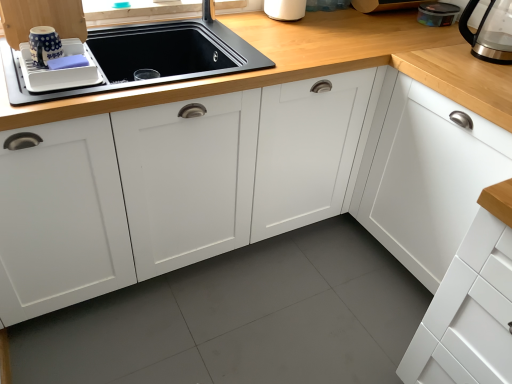
Question: Does point (10, 24) appear closer or farther from the camera than point (435, 11)?

Choices:
 (A) closer
 (B) farther

Answer: (A)

Question: Relative to transparent plastic container at upper right, which is the third appliance from front to back, is white glossy tray at upper left, the first cabinetry when ordered from left to right, in front or behind?

Choices:
 (A) front
 (B) behind

Answer: (A)

Question: Estimate the real-world distances between objects in this image. Which object is farther from the wooden cutting board at upper right, marked as the 4th appliance in a front-to-back arrangement?

Choices:
 (A) white plastic dish drainer at upper left, the 4th appliance from the back
 (B) blue dotted cup at upper left, which is the 2th appliance from front to back
 (C) white matte cabinet at center-right, the first cabinetry when ordered from right to left
 (D) white glossy tray at upper left, the first cabinetry when ordered from left to right
 (E) white glossy cabinet at center, which is the second cabinetry from left to right

Answer: (B)

Question: Which is nearer to the white plastic dish drainer at upper left, which is the 4th appliance from right to left?

Choices:
 (A) white matte cabinet at center-right, the first cabinetry when ordered from right to left
 (B) transparent glass coffeepot at upper right
 (C) wooden cutting board at upper right, marked as the 4th appliance in a front-to-back arrangement
 (D) white glossy cabinet at center, which is the second cabinetry from left to right
 (E) transparent plastic container at upper right, the second appliance viewed from the back

Answer: (D)